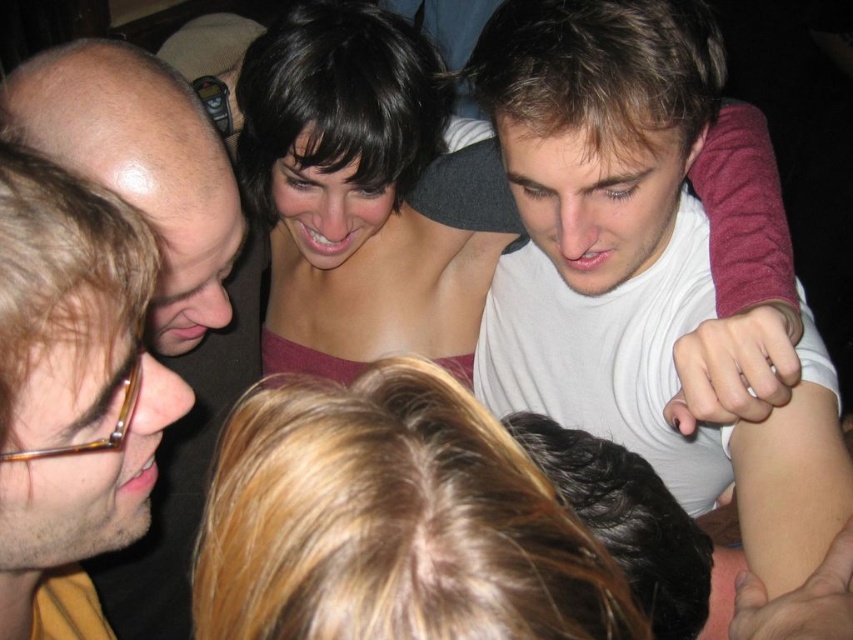
Question: Which of the following is the closest to the observer?

Choices:
 (A) (698, 438)
 (B) (293, 100)
 (C) (461, 492)

Answer: (C)

Question: Among these objects, which one is farthest from the camera?

Choices:
 (A) matte pink dress at center
 (B) brown tortoiseshell glasses at upper left
 (C) blonde hair at center
 (D) white matte shirt at upper right

Answer: (A)

Question: Among these objects, which one is farthest from the camera?

Choices:
 (A) white matte shirt at upper right
 (B) matte pink dress at center

Answer: (B)

Question: Observing the image, what is the correct spatial positioning of white matte shirt at upper right in reference to brown tortoiseshell glasses at upper left?

Choices:
 (A) above
 (B) below

Answer: (A)

Question: Is blonde hair at center wider than brown tortoiseshell glasses at upper left?

Choices:
 (A) no
 (B) yes

Answer: (A)

Question: Where is white matte shirt at upper right located in relation to matte pink dress at center in the image?

Choices:
 (A) right
 (B) left

Answer: (A)